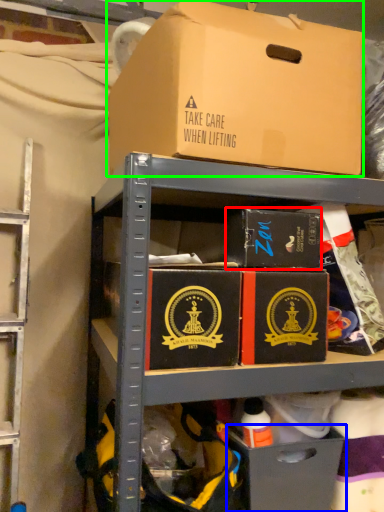
Question: Considering the real-world distances, which object is closest to box (highlighted by a red box)? drawer (highlighted by a blue box) or box (highlighted by a green box).

Choices:
 (A) drawer
 (B) box

Answer: (B)